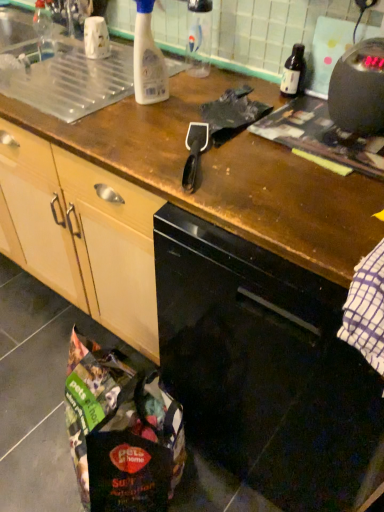
This screenshot has height=512, width=384. What are the coordinates of `translucent glass bottle at upper right, acting as the 1th bottle starting from the right` in the screenshot? It's located at (293, 72).

The image size is (384, 512). Describe the element at coordinates (148, 59) in the screenshot. I see `translucent plastic spray bottle at upper center, arranged as the first bottle when viewed from the left` at that location.

At what (x,y) coordinates should I click in order to perform the action: click on transparent plastic sink at upper center. Please return your answer as a coordinate pair (x, y). Image resolution: width=384 pixels, height=512 pixels. Looking at the image, I should click on click(73, 81).

Describe the element at coordinates (264, 371) in the screenshot. I see `black glossy dishwasher at center` at that location.

Where is `black plastic kettle at upper right`? Image resolution: width=384 pixels, height=512 pixels. black plastic kettle at upper right is located at coordinates (359, 89).

What do you see at coordinates (194, 153) in the screenshot? The height and width of the screenshot is (512, 384). I see `black plastic spatula at center` at bounding box center [194, 153].

Locate an element on the screen. This screenshot has height=512, width=384. translucent glass bottle at upper right, placed as the 3th bottle when sorted from left to right is located at coordinates (293, 72).

Which object is closer to the camera taking this photo, transparent plastic bottle at upper center, which appears as the second bottle when viewed from the right, or black glossy dishwasher at center?

black glossy dishwasher at center is closer to the camera.

Which of these two, transparent plastic bottle at upper center, which appears as the second bottle when viewed from the right, or black glossy dishwasher at center, is thinner?

Thinner between the two is transparent plastic bottle at upper center, which appears as the second bottle when viewed from the right.

Does point (207, 47) appear closer or farther from the camera than point (379, 465)?

Point (207, 47) appears to be farther away from the viewer than point (379, 465).

Is black glossy dishwasher at center completely or partially inside transparent plastic bottle at upper center, which appears as the second bottle when viewed from the right?

No, black glossy dishwasher at center is not inside transparent plastic bottle at upper center, which appears as the second bottle when viewed from the right.

From the image's perspective, is transparent plastic sink at upper center under transparent plastic bottle at upper center, which appears as the second bottle when viewed from the right?

Correct, transparent plastic sink at upper center appears lower than transparent plastic bottle at upper center, which appears as the second bottle when viewed from the right, in the image.

Measure the distance between transparent plastic sink at upper center and transparent plastic bottle at upper center, which appears as the second bottle when viewed from the right.

13.86 inches.

Considering the relative positions of transparent plastic sink at upper center and transparent plastic bottle at upper center, the 2th bottle from the left, in the image provided, is transparent plastic sink at upper center to the left or to the right of transparent plastic bottle at upper center, the 2th bottle from the left,?

Clearly, transparent plastic sink at upper center is on the left of transparent plastic bottle at upper center, the 2th bottle from the left, in the image.

Is transparent plastic sink at upper center facing away from transparent plastic bottle at upper center, which appears as the second bottle when viewed from the right?

No, transparent plastic sink at upper center's orientation is not away from transparent plastic bottle at upper center, which appears as the second bottle when viewed from the right.

Which of these two, black plastic spatula at center or black glossy dishwasher at center, is bigger?

black glossy dishwasher at center.

What's the angular difference between black plastic spatula at center and black glossy dishwasher at center's facing directions?

28.2 degrees.

From the image's perspective, is black plastic spatula at center positioned above or below black glossy dishwasher at center?

black plastic spatula at center is above black glossy dishwasher at center.

Which is closer, (195, 169) or (239, 330)?

Positioned in front is point (239, 330).

Which object is further away from the camera taking this photo, transparent plastic sink at upper center or black plastic kettle at upper right?

transparent plastic sink at upper center is further away from the camera.

Visually, is transparent plastic sink at upper center positioned to the left or to the right of black plastic kettle at upper right?

From the image, it's evident that transparent plastic sink at upper center is to the left of black plastic kettle at upper right.

Considering the sizes of objects transparent plastic sink at upper center and black plastic kettle at upper right in the image provided, who is taller, transparent plastic sink at upper center or black plastic kettle at upper right?

black plastic kettle at upper right.

Looking at this image, from the image's perspective, which is below, transparent plastic sink at upper center or black plastic kettle at upper right?

black plastic kettle at upper right is shown below in the image.

Considering the sizes of objects transparent plastic bottle at upper center, the 2th bottle from the left, and black plastic spatula at center in the image provided, who is wider, transparent plastic bottle at upper center, the 2th bottle from the left, or black plastic spatula at center?

black plastic spatula at center is wider.

Is transparent plastic bottle at upper center, the 2th bottle from the left, next to black plastic spatula at center and touching it?

No, transparent plastic bottle at upper center, the 2th bottle from the left, is not with black plastic spatula at center.

Who is taller, transparent plastic bottle at upper center, the 2th bottle from the left, or black plastic spatula at center?

transparent plastic bottle at upper center, the 2th bottle from the left.

Where is `bottle on the right of transparent plastic bottle at upper center, which appears as the second bottle when viewed from the right`? The image size is (384, 512). bottle on the right of transparent plastic bottle at upper center, which appears as the second bottle when viewed from the right is located at coordinates (293, 72).

Is transparent plastic bottle at upper center, the 2th bottle from the left, turned away from translucent glass bottle at upper right, placed as the 3th bottle when sorted from left to right?

No.

Between point (189, 2) and point (292, 47), which one is positioned in front?

The point (292, 47) is closer.

Can you confirm if transparent plastic bottle at upper center, the 2th bottle from the left, is bigger than translucent glass bottle at upper right, placed as the 3th bottle when sorted from left to right?

Yes, transparent plastic bottle at upper center, the 2th bottle from the left, is bigger than translucent glass bottle at upper right, placed as the 3th bottle when sorted from left to right.

From a real-world perspective, is transparent plastic sink at upper center physically below black plastic spatula at center?

Yes, from a real-world perspective, transparent plastic sink at upper center is beneath black plastic spatula at center.

Is transparent plastic sink at upper center to the left or to the right of black plastic spatula at center in the image?

transparent plastic sink at upper center is to the left of black plastic spatula at center.

From the image's perspective, count 3rd bottles upward from the black glossy dishwasher at center and point to it. Please provide its 2D coordinates.

[(199, 37)]

The image size is (384, 512). What are the coordinates of `the 2nd bottle behind the transparent plastic sink at upper center` in the screenshot? It's located at (199, 37).

Considering their positions, is black glossy dishwasher at center positioned further to translucent plastic spray bottle at upper center, arranged as the first bottle when viewed from the left, than transparent plastic bottle at upper center, the 2th bottle from the left?

The object further to translucent plastic spray bottle at upper center, arranged as the first bottle when viewed from the left, is black glossy dishwasher at center.

Based on their spatial positions, is translucent plastic spray bottle at upper center, arranged as the first bottle when viewed from the left, or black plastic spatula at center further from translucent glass bottle at upper right, placed as the 3th bottle when sorted from left to right?

black plastic spatula at center is further to translucent glass bottle at upper right, placed as the 3th bottle when sorted from left to right.

From the image, which object appears to be farther from black plastic spatula at center, black plastic kettle at upper right or transparent plastic bottle at upper center, which appears as the second bottle when viewed from the right?

transparent plastic bottle at upper center, which appears as the second bottle when viewed from the right.

Looking at the image, which one is located further to transparent plastic sink at upper center, black plastic spatula at center or translucent glass bottle at upper right, acting as the 1th bottle starting from the right?

Based on the image, translucent glass bottle at upper right, acting as the 1th bottle starting from the right, appears to be further to transparent plastic sink at upper center.

Based on their spatial positions, is black glossy dishwasher at center or transparent plastic bottle at upper center, which appears as the second bottle when viewed from the right, closer to black plastic spatula at center?

transparent plastic bottle at upper center, which appears as the second bottle when viewed from the right, lies closer to black plastic spatula at center than the other object.

Based on their spatial positions, is translucent glass bottle at upper right, acting as the 1th bottle starting from the right, or transparent plastic bottle at upper center, the 2th bottle from the left, closer to black plastic kettle at upper right?

translucent glass bottle at upper right, acting as the 1th bottle starting from the right, is closer to black plastic kettle at upper right.

Estimate the real-world distances between objects in this image. Which object is further from transparent plastic bottle at upper center, the 2th bottle from the left, translucent glass bottle at upper right, placed as the 3th bottle when sorted from left to right, or black glossy dishwasher at center?

black glossy dishwasher at center.

From the image, which object appears to be farther from translucent plastic spray bottle at upper center, arranged as the third bottle when viewed from the right, black glossy dishwasher at center or black plastic spatula at center?

Among the two, black glossy dishwasher at center is located further to translucent plastic spray bottle at upper center, arranged as the third bottle when viewed from the right.

Locate an element on the screen. Image resolution: width=384 pixels, height=512 pixels. appliance between translucent plastic spray bottle at upper center, arranged as the first bottle when viewed from the left, and black plastic kettle at upper right is located at coordinates (194, 153).

Where is `bottle between transparent plastic bottle at upper center, which appears as the second bottle when viewed from the right, and black plastic kettle at upper right from left to right`? The height and width of the screenshot is (512, 384). bottle between transparent plastic bottle at upper center, which appears as the second bottle when viewed from the right, and black plastic kettle at upper right from left to right is located at coordinates (293, 72).

Where is `appliance located between transparent plastic sink at upper center and black plastic kettle at upper right in the left-right direction`? appliance located between transparent plastic sink at upper center and black plastic kettle at upper right in the left-right direction is located at coordinates (194, 153).

Identify the location of sink between transparent plastic bottle at upper center, which appears as the second bottle when viewed from the right, and black glossy dishwasher at center, in the vertical direction. [x=73, y=81].